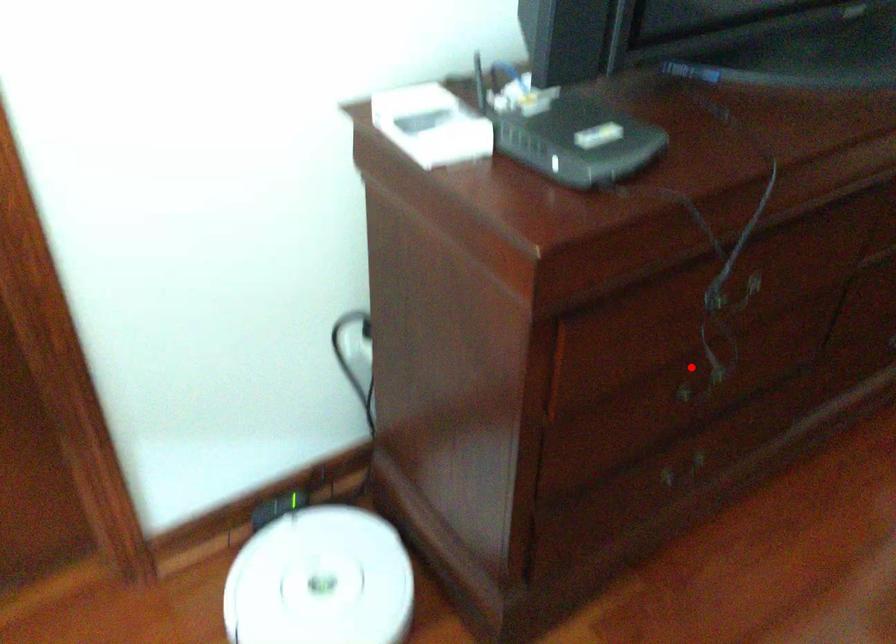
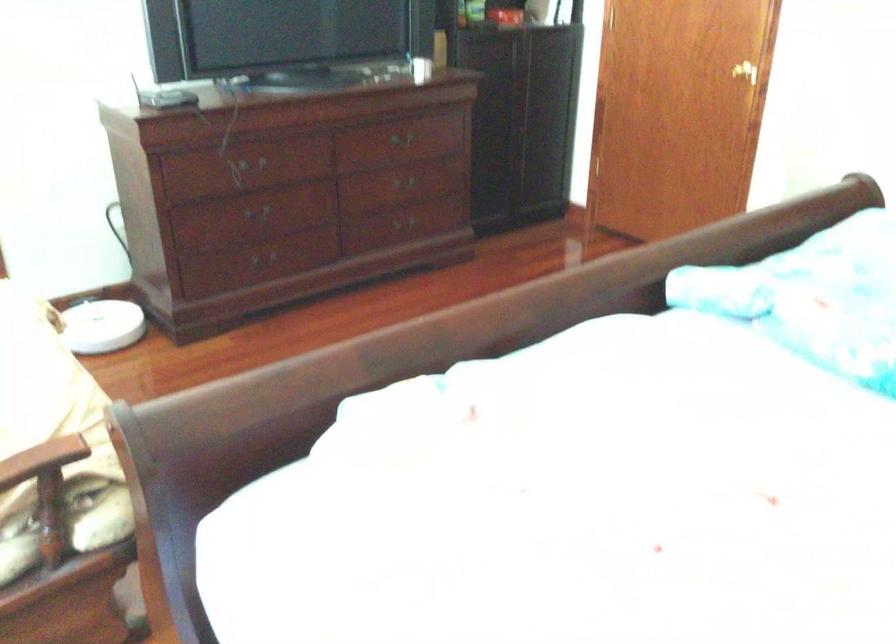
Find the pixel in the second image that matches the highlighted location in the first image.

(255, 210)